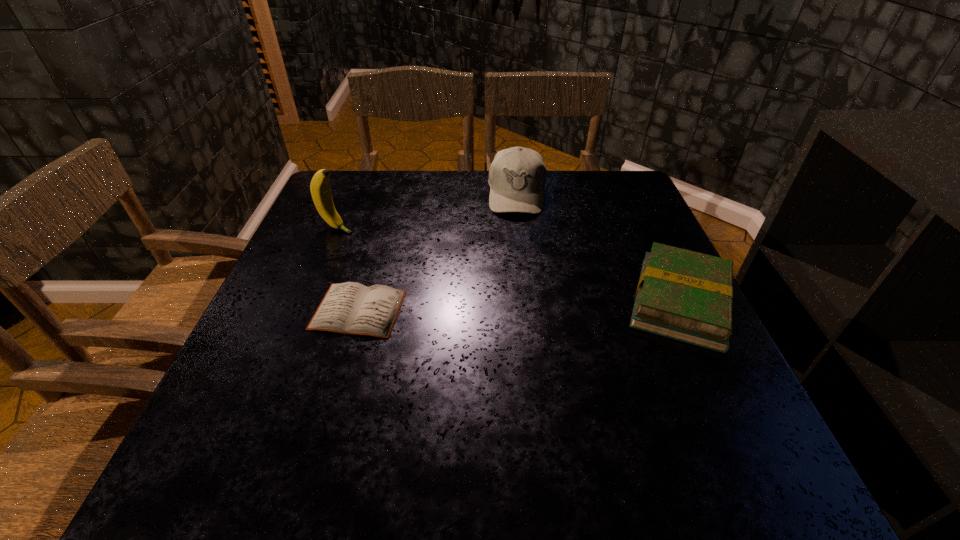
The height and width of the screenshot is (540, 960). In order to click on free point between the rightmost object and the third object from left to right in this screenshot , I will do `click(599, 248)`.

The height and width of the screenshot is (540, 960). Find the location of `free space between the diary and the third tallest object`. free space between the diary and the third tallest object is located at coordinates (519, 306).

Identify the location of free space between the banana and the third shortest object. The width and height of the screenshot is (960, 540). 427,211.

Identify the location of free spot between the second object from right to left and the tallest object. This screenshot has height=540, width=960. (427, 211).

Locate an element on the screen. empty space between the shortest object and the third tallest object is located at coordinates (519, 306).

Locate which object is the closest to the rightmost object. Please provide its 2D coordinates. Your answer should be formatted as a tuple, i.e. [(x, y)], where the tuple contains the x and y coordinates of a point satisfying the conditions above.

[(517, 176)]

Select which object is the third closest to the book. Please provide its 2D coordinates. Your answer should be formatted as a tuple, i.e. [(x, y)], where the tuple contains the x and y coordinates of a point satisfying the conditions above.

[(320, 190)]

The width and height of the screenshot is (960, 540). Identify the location of free space that satisfies the following two spatial constraints: 1. on the front side of the rightmost object; 2. on the right side of the second farthest object. (307, 302).

Locate an element on the screen. The width and height of the screenshot is (960, 540). free space that satisfies the following two spatial constraints: 1. on the back side of the second farthest object; 2. on the right side of the third shortest object is located at coordinates (351, 194).

Find the location of `free space that satisfies the following two spatial constraints: 1. on the front side of the baseball cap; 2. on the left side of the third tallest object`. free space that satisfies the following two spatial constraints: 1. on the front side of the baseball cap; 2. on the left side of the third tallest object is located at coordinates (530, 302).